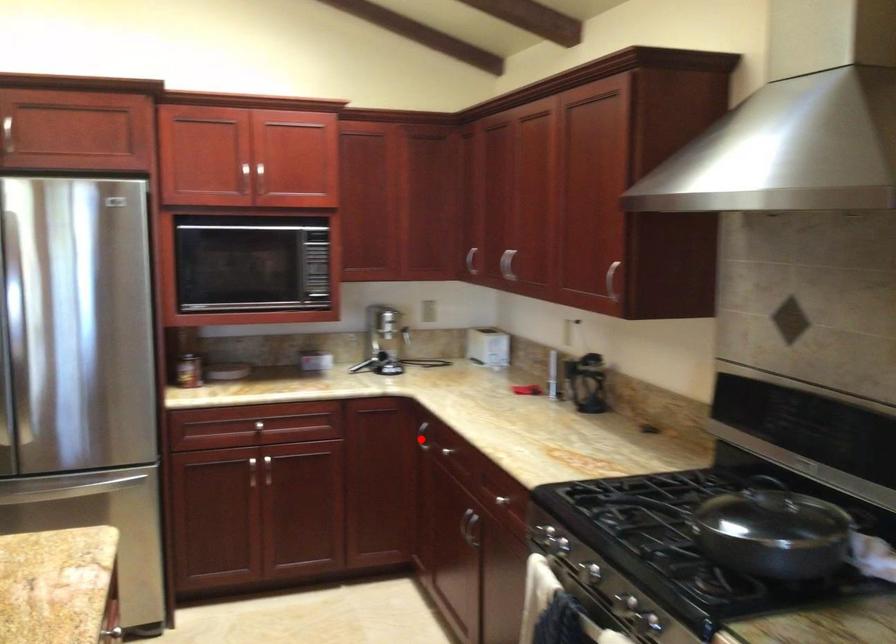
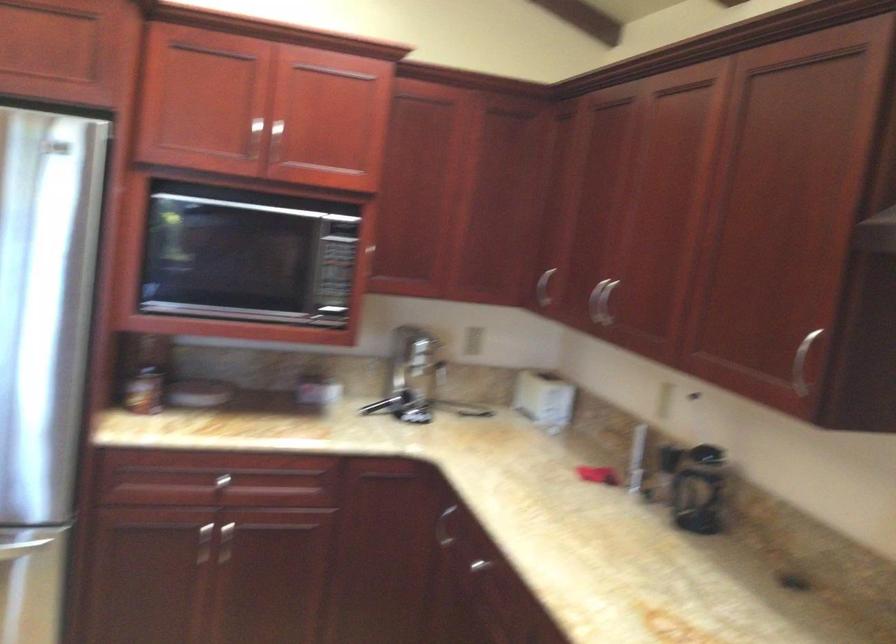
Find the pixel in the second image that matches the highlighted location in the first image.

(444, 527)